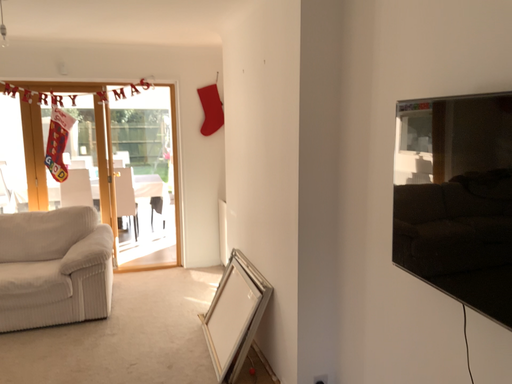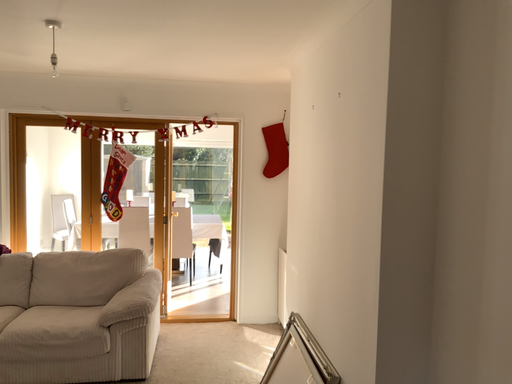
Question: Which way did the camera rotate in the video?

Choices:
 (A) rotated left
 (B) rotated right

Answer: (A)